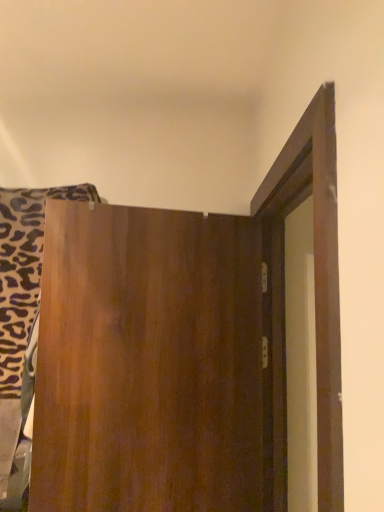
Question: Is wooden door at center oriented towards wooden board at left?

Choices:
 (A) yes
 (B) no

Answer: (B)

Question: Is wooden board at left a part of wooden door at center?

Choices:
 (A) yes
 (B) no

Answer: (B)

Question: Are wooden door at center and wooden board at left far apart?

Choices:
 (A) yes
 (B) no

Answer: (B)

Question: Considering the relative sizes of wooden door at center and wooden board at left in the image provided, is wooden door at center taller than wooden board at left?

Choices:
 (A) yes
 (B) no

Answer: (A)

Question: Would you say wooden door at center is outside wooden board at left?

Choices:
 (A) yes
 (B) no

Answer: (A)

Question: Is wooden door at center facing away from wooden board at left?

Choices:
 (A) yes
 (B) no

Answer: (A)

Question: From a real-world perspective, does wooden board at left stand above wooden door at center?

Choices:
 (A) yes
 (B) no

Answer: (A)

Question: Is wooden board at left thinner than wooden door at center?

Choices:
 (A) no
 (B) yes

Answer: (A)

Question: Is wooden board at left aimed at wooden door at center?

Choices:
 (A) no
 (B) yes

Answer: (A)

Question: Considering the relative sizes of wooden board at left and wooden door at center in the image provided, is wooden board at left wider than wooden door at center?

Choices:
 (A) yes
 (B) no

Answer: (A)

Question: From the image's perspective, is wooden board at left above wooden door at center?

Choices:
 (A) yes
 (B) no

Answer: (A)

Question: Is wooden board at left not close to wooden door at center?

Choices:
 (A) yes
 (B) no

Answer: (B)

Question: From the image's perspective, is wooden door at center above or below wooden board at left?

Choices:
 (A) above
 (B) below

Answer: (B)